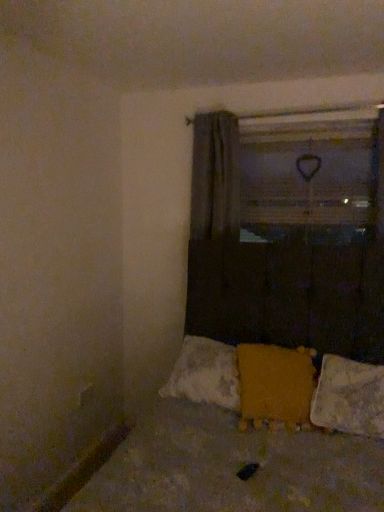
Question: From the image's perspective, would you say yellow fuzzy pillow at lower center, which is the 1th pillow in left-to-right order, is positioned over transparent plastic window screen at upper center?

Choices:
 (A) yes
 (B) no

Answer: (B)

Question: From the image's perspective, is yellow fuzzy pillow at lower center, which is the 1th pillow in left-to-right order, below transparent plastic window screen at upper center?

Choices:
 (A) yes
 (B) no

Answer: (A)

Question: Is yellow fuzzy pillow at lower center, which is the 1th pillow in left-to-right order, not near transparent plastic window screen at upper center?

Choices:
 (A) yes
 (B) no

Answer: (A)

Question: Is yellow fuzzy pillow at lower center, the 2th pillow from the right, not inside transparent plastic window screen at upper center?

Choices:
 (A) yes
 (B) no

Answer: (A)

Question: From a real-world perspective, is yellow fuzzy pillow at lower center, which is the 1th pillow in left-to-right order, below transparent plastic window screen at upper center?

Choices:
 (A) yes
 (B) no

Answer: (A)

Question: Is yellow fuzzy pillow at lower center, which is the 1th pillow in left-to-right order, at the left side of transparent plastic window screen at upper center?

Choices:
 (A) yes
 (B) no

Answer: (A)

Question: Is yellow fuzzy pillow at lower center, the 2th pillow from the right, positioned behind textured yellow fabric at lower center?

Choices:
 (A) no
 (B) yes

Answer: (B)

Question: Can you confirm if yellow fuzzy pillow at lower center, the 2th pillow from the right, is shorter than textured yellow fabric at lower center?

Choices:
 (A) yes
 (B) no

Answer: (A)

Question: Can you confirm if yellow fuzzy pillow at lower center, the 2th pillow from the right, is thinner than textured yellow fabric at lower center?

Choices:
 (A) yes
 (B) no

Answer: (A)

Question: Does yellow fuzzy pillow at lower center, which is the 1th pillow in left-to-right order, have a larger size compared to textured yellow fabric at lower center?

Choices:
 (A) no
 (B) yes

Answer: (A)

Question: From the image's perspective, is yellow fuzzy pillow at lower center, the 2th pillow from the right, beneath textured yellow fabric at lower center?

Choices:
 (A) no
 (B) yes

Answer: (A)

Question: From a real-world perspective, is yellow fuzzy pillow at lower center, which is the 1th pillow in left-to-right order, located higher than textured yellow fabric at lower center?

Choices:
 (A) yes
 (B) no

Answer: (A)

Question: Considering the relative positions of white textured pillow at lower right, the second pillow positioned from the left, and yellow fuzzy pillow at lower center, the 2th pillow from the right, in the image provided, is white textured pillow at lower right, the second pillow positioned from the left, in front of yellow fuzzy pillow at lower center, the 2th pillow from the right,?

Choices:
 (A) yes
 (B) no

Answer: (A)